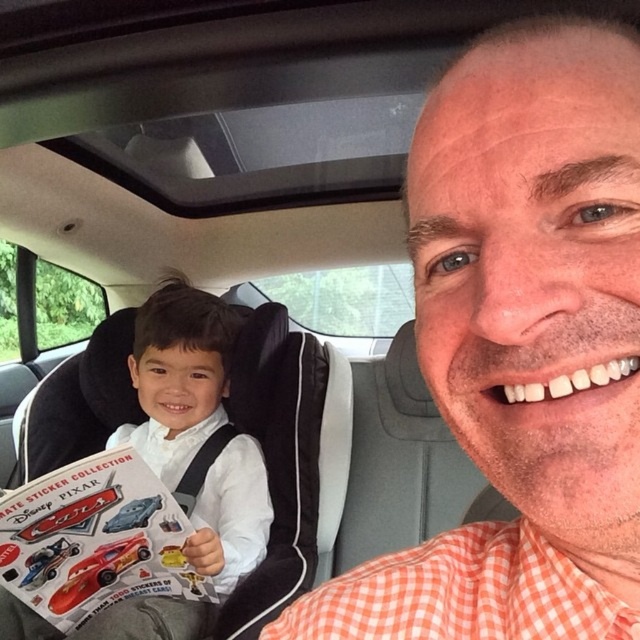
You are a fashion designer observing the car scene. You notice the orange checkered shirt at center and the white smooth shirt at center. Which shirt is positioned higher in the image?

The orange checkered shirt at center is located above the white smooth shirt at center, so it is positioned higher in the image.

You are a passenger in the car and want to hand the shiny red toy car at center to the driver wearing the white smooth shirt at center. Which direction should you move the toy car to reach the driver?

The white smooth shirt at center is to the right of the shiny red toy car at center, so you should move the shiny red toy car at center to the right to reach the driver wearing the white smooth shirt at center.